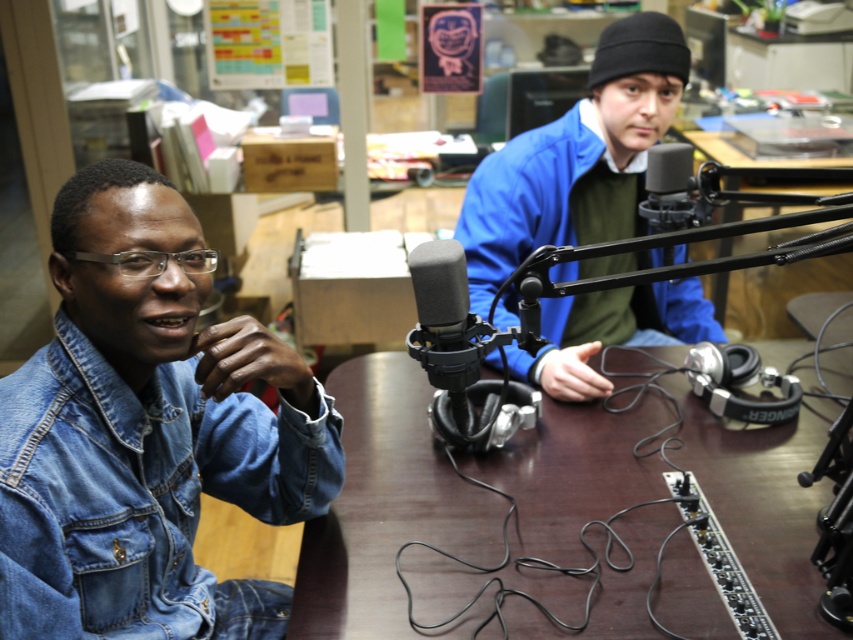
Measure the distance between denim jacket at lower right and blue denim jacket at center.

denim jacket at lower right and blue denim jacket at center are 30.26 inches apart.

Is denim jacket at lower right taller than blue denim jacket at center?

No, denim jacket at lower right is not taller than blue denim jacket at center.

Does point (257, 417) come farther from viewer compared to point (657, 298)?

No, it is not.

At what (x,y) coordinates should I click in order to perform the action: click on denim jacket at lower right. Please return your answer as a coordinate pair (x, y). This screenshot has width=853, height=640. Looking at the image, I should click on coord(137,490).

Does point (213, 449) come behind point (480, 348)?

Yes, point (213, 449) is behind point (480, 348).

Which is more to the left, denim jacket at lower right or black matte microphone at center?

From the viewer's perspective, denim jacket at lower right appears more on the left side.

Is point (331, 476) positioned after point (450, 275)?

Yes.

The height and width of the screenshot is (640, 853). Find the location of `denim jacket at lower right`. denim jacket at lower right is located at coordinates (137, 490).

Is point (445, 502) farther from camera compared to point (462, 360)?

Yes, it is behind point (462, 360).

Find the location of a particular element. brown wooden table at center is located at coordinates (386, 506).